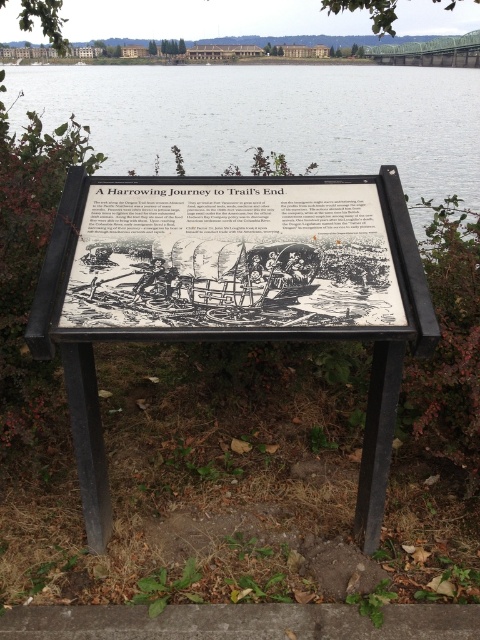
You are planning to take a photo of the black wood sign at center and the transparent water at center. Which object will appear larger in the photo?

The transparent water at center will appear larger in the photo because it is taller than the black wood sign at center.

You are a hiker who wants to read the signboard but also wants to avoid getting your feet wet. The black wood sign at center and transparent water at center are both in your path. Which object should you approach first to stay dry?

The black wood sign at center is to the right of transparent water at center, so you should approach the black wood sign at center first to avoid stepping into the transparent water at center.

You are a hiker who wants to take a photo of the black wood sign at center. Where should you position yourself to ensure the sign is centered in your camera viewfinder?

The black wood sign at center is located at point (231, 291), so you should position yourself directly in front of the sign at that coordinate to center it in your camera viewfinder.